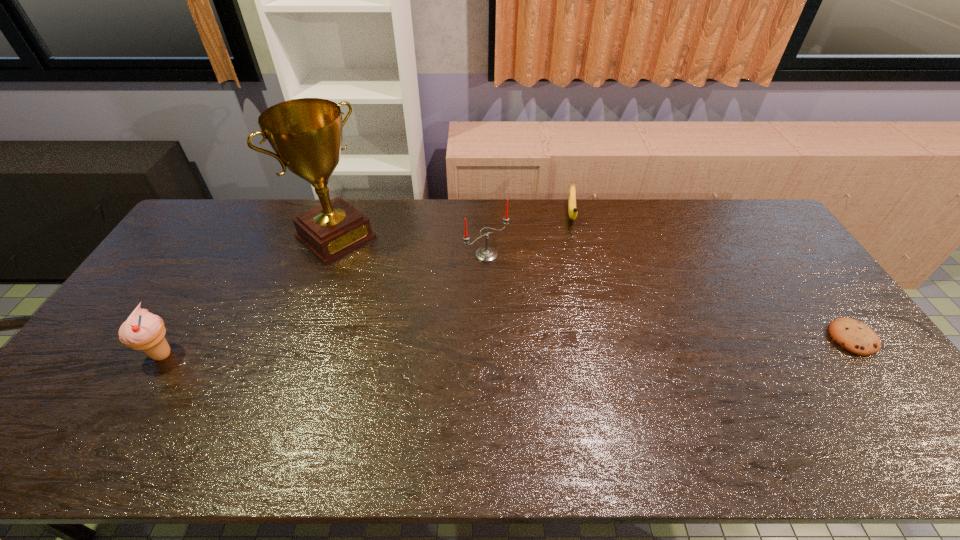
Locate an element on the screen. The height and width of the screenshot is (540, 960). vacant point that satisfies the following two spatial constraints: 1. on the back side of the fourth object from left to right; 2. on the right side of the leftmost object is located at coordinates (249, 214).

Identify the location of vacant space that satisfies the following two spatial constraints: 1. on the back side of the icecream; 2. on the left side of the third object from left to right. (224, 255).

Find the location of a particular element. free location that satisfies the following two spatial constraints: 1. on the front side of the candle; 2. on the right side of the rightmost object is located at coordinates (488, 338).